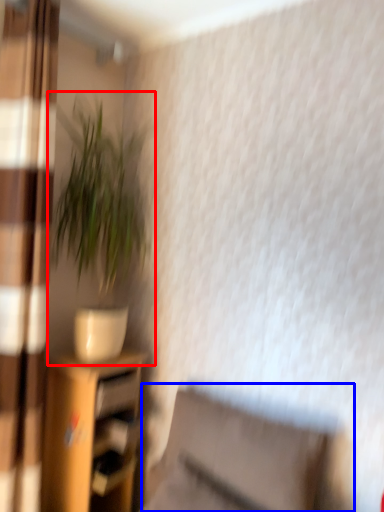
Question: Among these objects, which one is nearest to the camera, houseplant (highlighted by a red box) or swivel chair (highlighted by a blue box)?

Choices:
 (A) houseplant
 (B) swivel chair

Answer: (B)